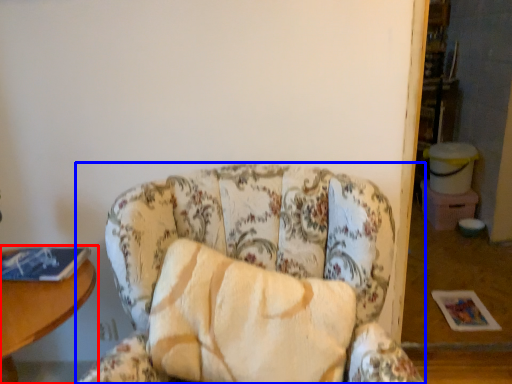
Question: Which point is closer to the camera, table (highlighted by a red box) or chair (highlighted by a blue box)?

Choices:
 (A) table
 (B) chair

Answer: (B)